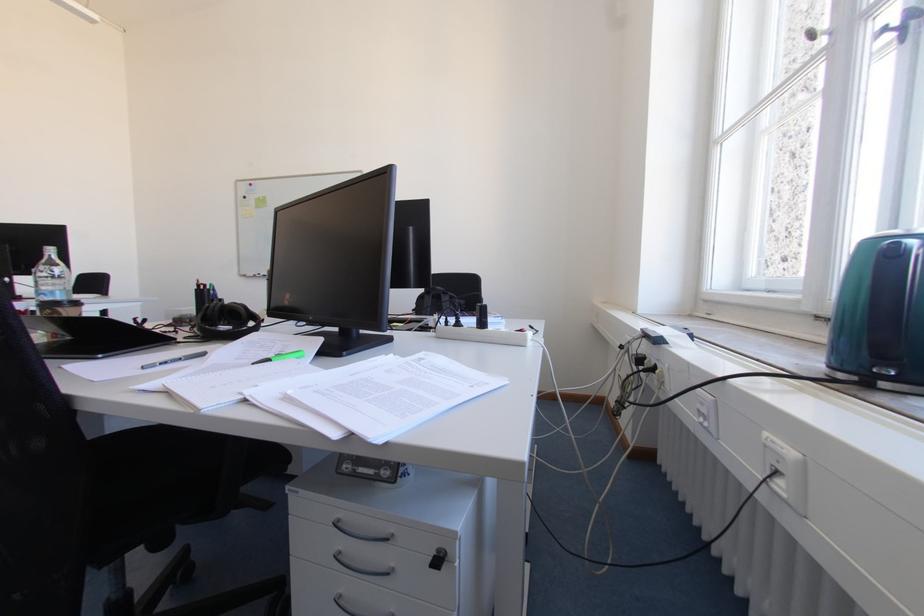
Locate an element on the screen. Image resolution: width=924 pixels, height=616 pixels. black headphones is located at coordinates (225, 321).